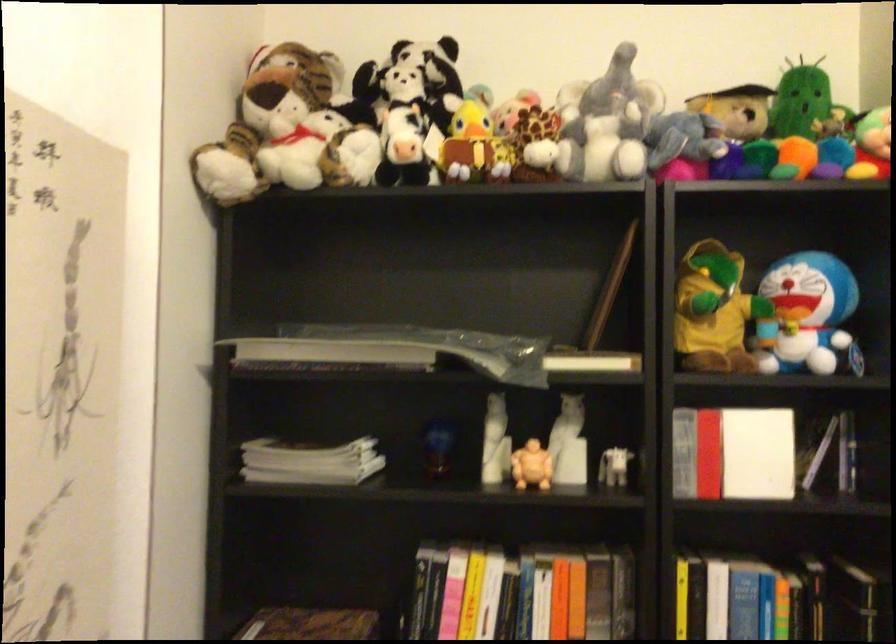
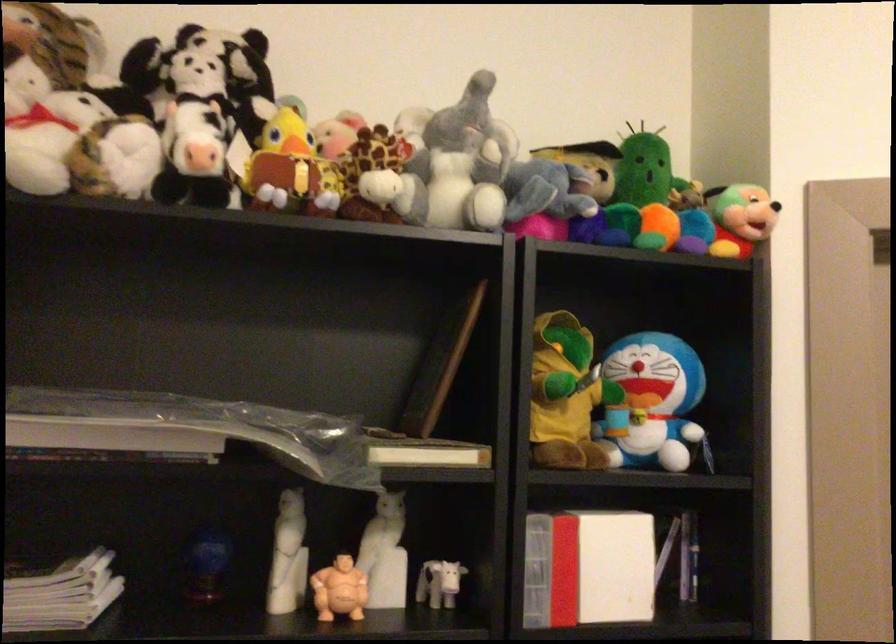
The point at (752, 453) is marked in the first image. Where is the corresponding point in the second image?

(609, 565)